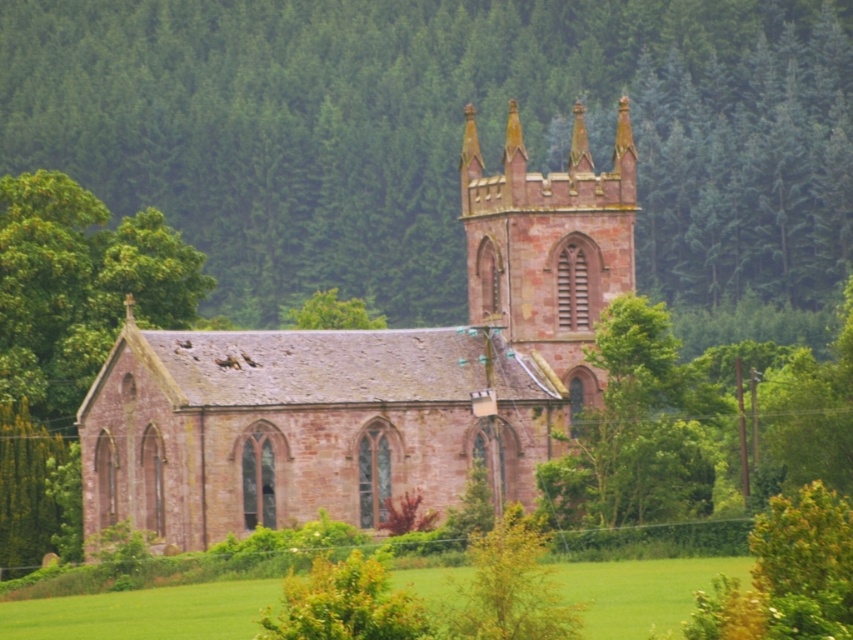
Question: Which object is the closest to the green grass at lower center?

Choices:
 (A) green leafy tree at center
 (B) rustic stone church at center

Answer: (B)

Question: Which object is positioned closest to the rustic stone church at center?

Choices:
 (A) green leafy tree at center
 (B) green grass at lower center

Answer: (B)

Question: From the image, what is the correct spatial relationship of green leafy tree at center in relation to green grass at lower center?

Choices:
 (A) below
 (B) above

Answer: (B)

Question: Can you confirm if green leafy tree at center is positioned to the right of green grass at lower center?

Choices:
 (A) yes
 (B) no

Answer: (B)

Question: Among these objects, which one is farthest from the camera?

Choices:
 (A) green grass at lower center
 (B) green leafy tree at center

Answer: (B)

Question: From the image, what is the correct spatial relationship of green leafy tree at center in relation to rustic stone church at center?

Choices:
 (A) left
 (B) right

Answer: (B)